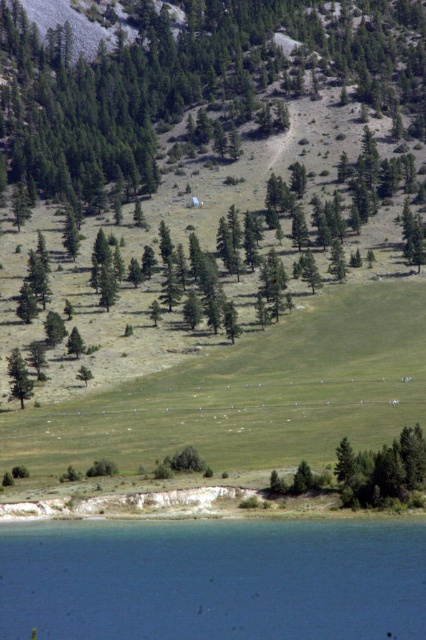
Question: Does green leafy tree at center have a smaller size compared to blue liquid water at lower center?

Choices:
 (A) no
 (B) yes

Answer: (A)

Question: Can you confirm if green leafy tree at center is smaller than green matte tree at left?

Choices:
 (A) no
 (B) yes

Answer: (A)

Question: Which point is closer to the camera taking this photo?

Choices:
 (A) (166, 332)
 (B) (109, 536)
 (C) (8, 358)

Answer: (B)

Question: Which object appears farthest from the camera in this image?

Choices:
 (A) green matte tree at left
 (B) green leafy tree at center

Answer: (B)

Question: Which point is closer to the camera taking this photo?

Choices:
 (A) (0, 104)
 (B) (14, 371)

Answer: (B)

Question: Does blue liquid water at lower center have a lesser width compared to green matte tree at left?

Choices:
 (A) yes
 (B) no

Answer: (B)